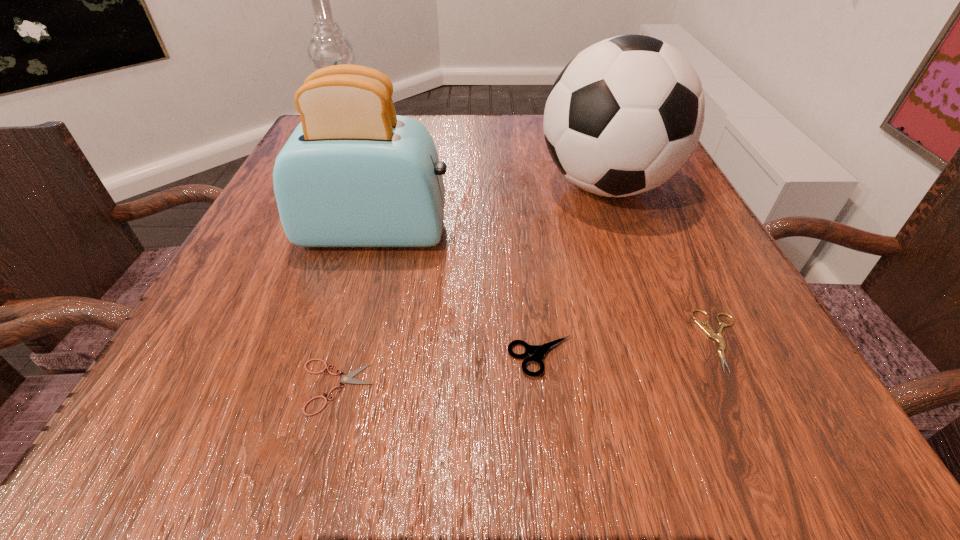
I want to click on free space located 0.270m on the side of the toaster with the lever, so pos(608,232).

Image resolution: width=960 pixels, height=540 pixels. What are the coordinates of `vacant space located on the left of the soccer ball` in the screenshot? It's located at (394, 186).

Locate an element on the screen. This screenshot has height=540, width=960. blank area located on the left of the second shears from right to left is located at coordinates (314, 357).

In order to click on free space located on the back of the second shortest object in this screenshot , I will do `click(660, 215)`.

Where is `free space located 0.130m on the right of the shortest object`? This screenshot has width=960, height=540. free space located 0.130m on the right of the shortest object is located at coordinates click(x=479, y=387).

Locate an element on the screen. This screenshot has height=540, width=960. oil lamp situated at the far edge is located at coordinates (328, 46).

Locate an element on the screen. Image resolution: width=960 pixels, height=540 pixels. soccer ball present at the far edge is located at coordinates (624, 116).

Find the location of a particular element. object positioned at the near edge is located at coordinates (347, 378).

Image resolution: width=960 pixels, height=540 pixels. Find the location of `oil lamp positioned at the left edge`. oil lamp positioned at the left edge is located at coordinates (328, 46).

You are a GUI agent. You are given a task and a screenshot of the screen. Output one action in this format:
    pyautogui.click(x=<x>, y=<y>)
    Task: Click on the toaster situated at the left edge
    
    Given the screenshot: What is the action you would take?
    pyautogui.click(x=353, y=173)